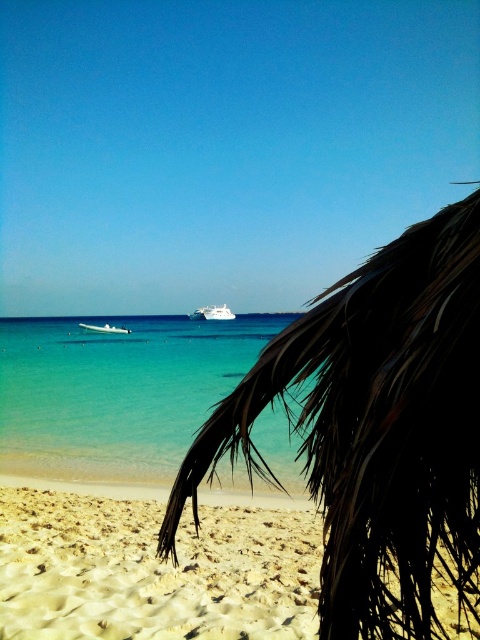
Who is taller, dark brown fronds at center or white glossy boat at center?

A: dark brown fronds at center is taller.

Who is more forward, (170, 554) or (122, 326)?

Point (170, 554) is in front.

Which is behind, point (396, 612) or point (120, 330)?

The point (120, 330) is more distant.

Where is `dark brown fronds at center`? This screenshot has height=640, width=480. dark brown fronds at center is located at coordinates (375, 428).

From the picture: Does beige sandy beach at lower left appear on the left side of white glossy cruise ship at center?

Incorrect, beige sandy beach at lower left is not on the left side of white glossy cruise ship at center.

This screenshot has width=480, height=640. Describe the element at coordinates (153, 570) in the screenshot. I see `beige sandy beach at lower left` at that location.

This screenshot has height=640, width=480. I want to click on beige sandy beach at lower left, so click(x=153, y=570).

Which of these two, clear blue water at center or white glossy boat at center, stands shorter?

white glossy boat at center

Is point (139, 424) closer to viewer compared to point (122, 332)?

That is True.

Who is more distant from viewer, (166, 330) or (127, 328)?

Point (166, 330)

Image resolution: width=480 pixels, height=640 pixels. I want to click on clear blue water at center, so click(117, 390).